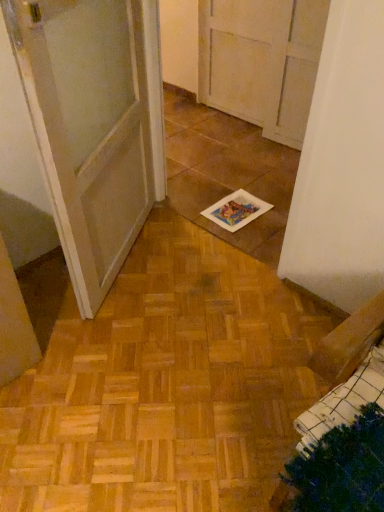
This screenshot has height=512, width=384. In order to click on vacant area situated below white paper at center (from a real-world perspective) in this screenshot , I will do `click(243, 210)`.